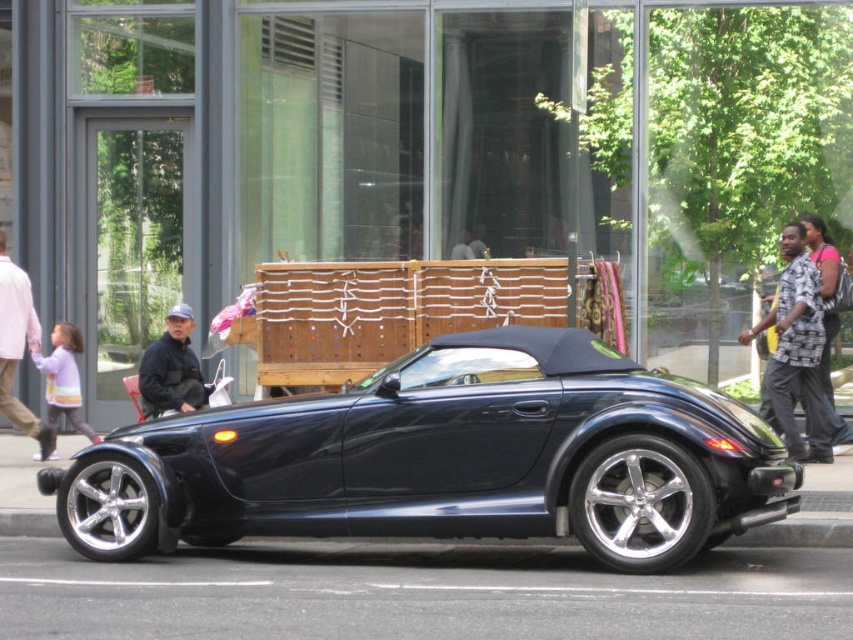
Question: Which of these objects is positioned farthest from the light purple sweater at left?

Choices:
 (A) printed fabric shirt at right
 (B) dark blue jacket at center
 (C) light pink shirt at left

Answer: (A)

Question: Which point is farther to the camera?

Choices:
 (A) glossy black convertible at center
 (B) light pink shirt at left
 (C) dark blue jacket at center
 (D) light purple sweater at left

Answer: (D)

Question: Is printed fabric shirt at right further to the viewer compared to light purple sweater at left?

Choices:
 (A) yes
 (B) no

Answer: (B)

Question: Does glossy black convertible at center come behind light pink shirt at left?

Choices:
 (A) no
 (B) yes

Answer: (A)

Question: Can you confirm if glossy black convertible at center is thinner than dark blue jacket at center?

Choices:
 (A) no
 (B) yes

Answer: (A)

Question: Considering the real-world distances, which object is farthest from the dark blue jacket at center?

Choices:
 (A) light pink shirt at left
 (B) light purple sweater at left
 (C) printed fabric shirt at right

Answer: (C)